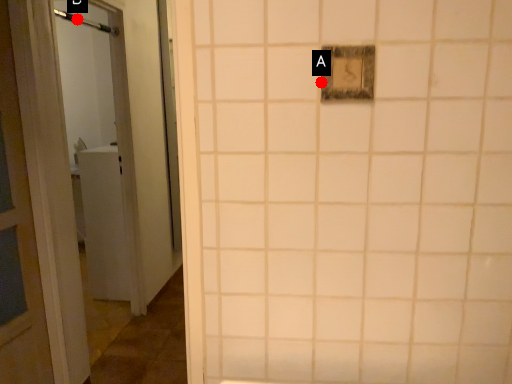
Question: Two points are circled on the image, labeled by A and B beside each circle. Among these points, which one is farthest from the camera?

Choices:
 (A) A is further
 (B) B is further

Answer: (B)